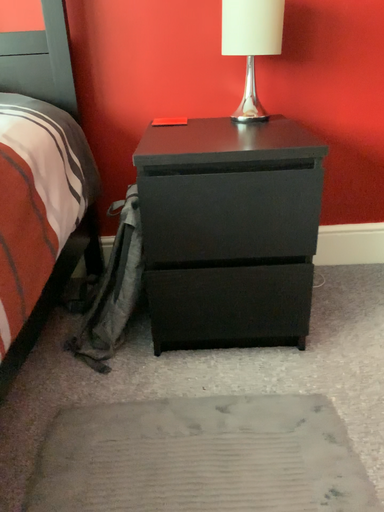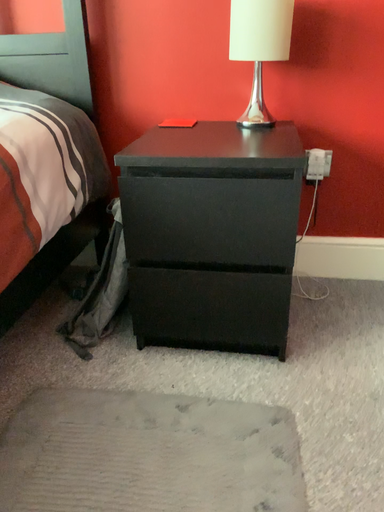
Question: Which way did the camera rotate in the video?

Choices:
 (A) rotated left
 (B) rotated right

Answer: (A)